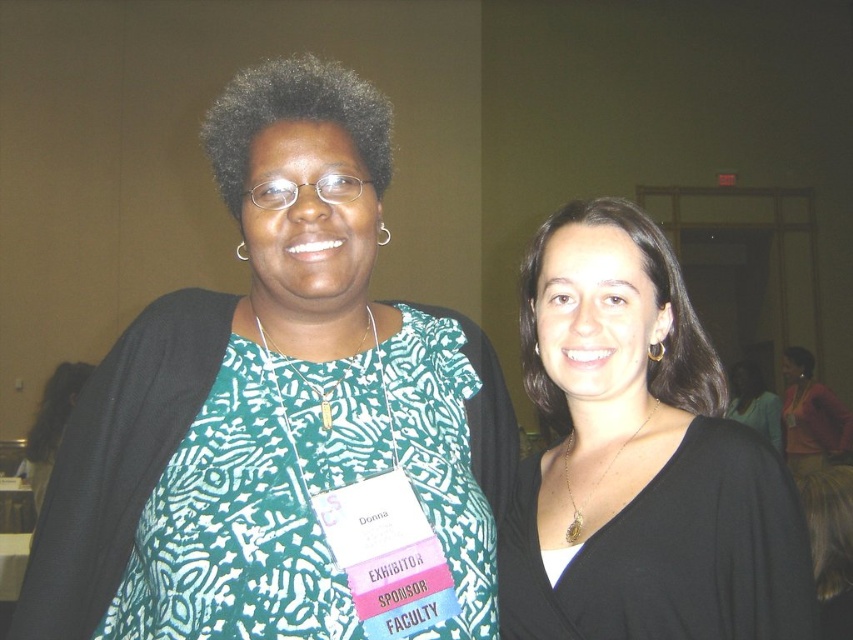
You are standing at the origin of the coordinate system and looking towards the image. There are two points marked in the image, point 1 at coordinates point (399,602) and point 2 at coordinates point (750,573). Which point is closer to you?

Point 1 at coordinates point (399,602) is closer to you because it is in front of point 2 at coordinates point (750,573).